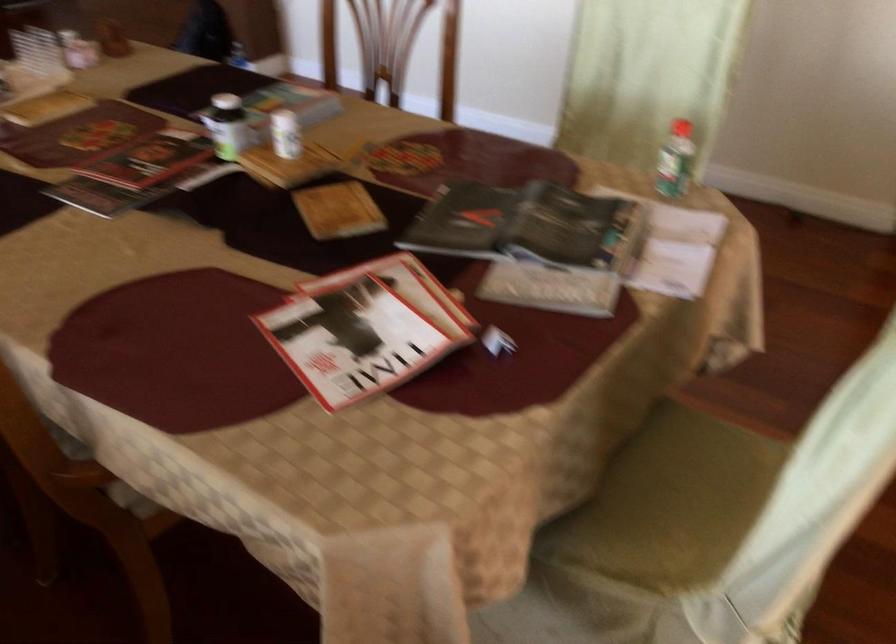
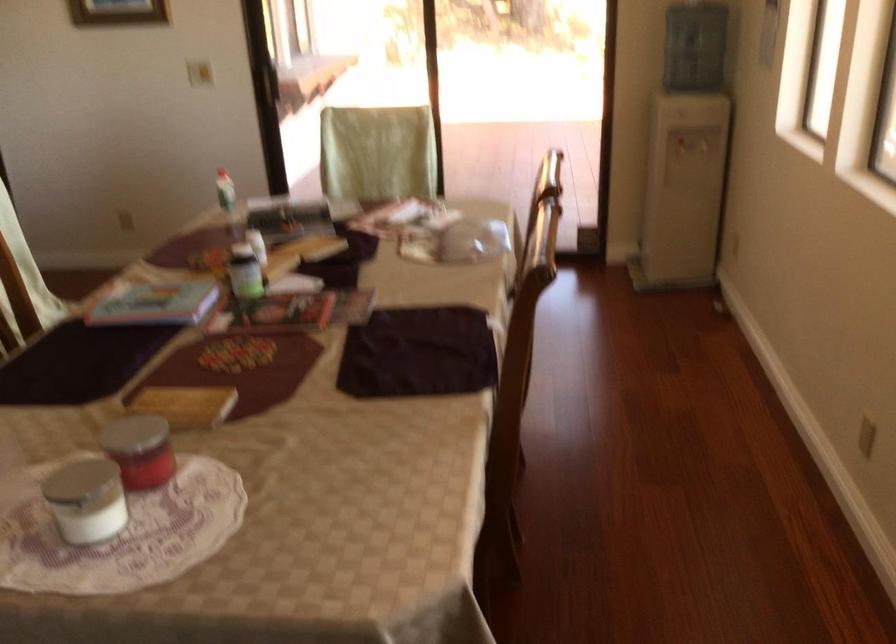
Where in the second image is the point corresponding to pixel 234 122 from the first image?

(245, 272)